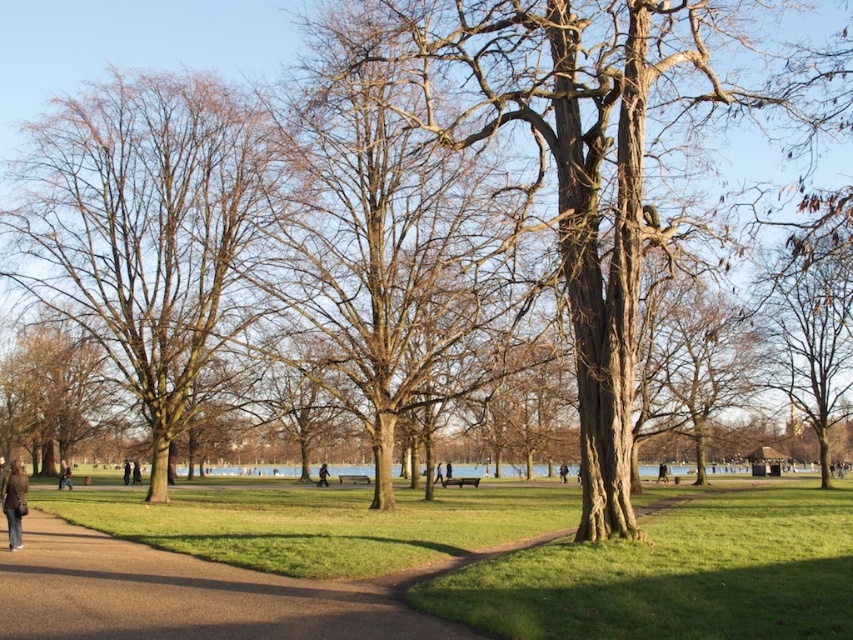
You are standing on the grassy area in the park and see the bare wood tree at left and the matte brown jacket at lower left. Which object is higher in height?

The bare wood tree at left is taller than the matte brown jacket at lower left.

You are a park visitor who wants to place a small potted plant between the matte brown jacket at lower left and the dark brown leather jacket at center. Which jacket should the plant be closer to if you want it to be closer to the taller jacket?

The matte brown jacket at lower left is taller than the dark brown leather jacket at center, so the plant should be closer to the matte brown jacket at lower left.

You are standing in the park and want to walk from the point at coordinates point (787,390) to the point at coordinates point (61,476). Which direction should you move relative to your current position?

You should move downward and to the right because point (61,476) is located below and to the right of point (787,390).